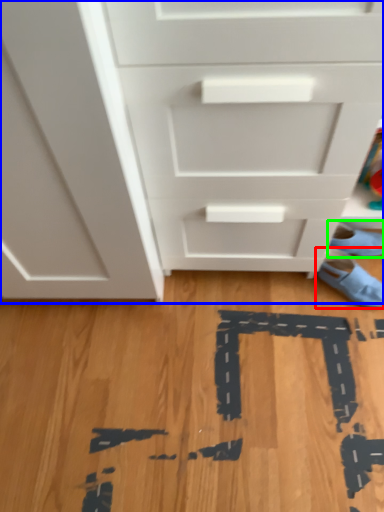
Question: Estimate the real-world distances between objects in this image. Which object is closer to footwear (highlighted by a red box), chest of drawers (highlighted by a blue box) or footwear (highlighted by a green box)?

Choices:
 (A) chest of drawers
 (B) footwear

Answer: (B)